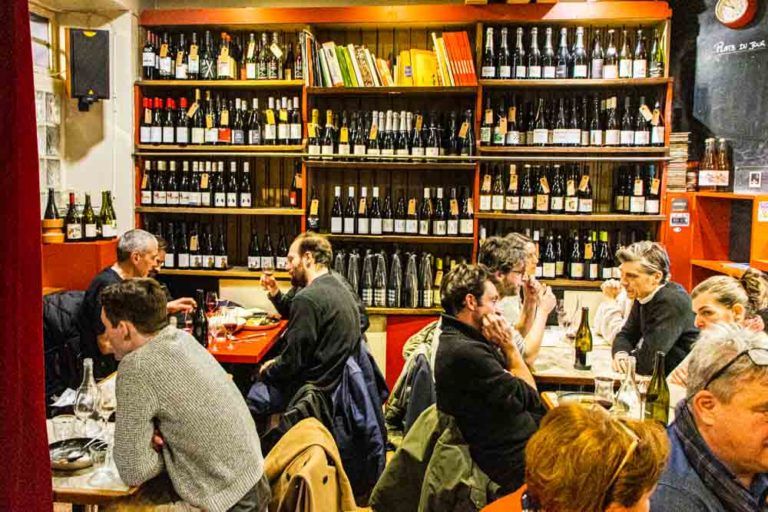
You are a GUI agent. You are given a task and a screenshot of the screen. Output one action in this format:
    pyautogui.click(x=<x>, y=<y>)
    Task: Click on the chair
    This screenshot has width=768, height=512.
    Given the screenshot: What is the action you would take?
    pos(295,497)